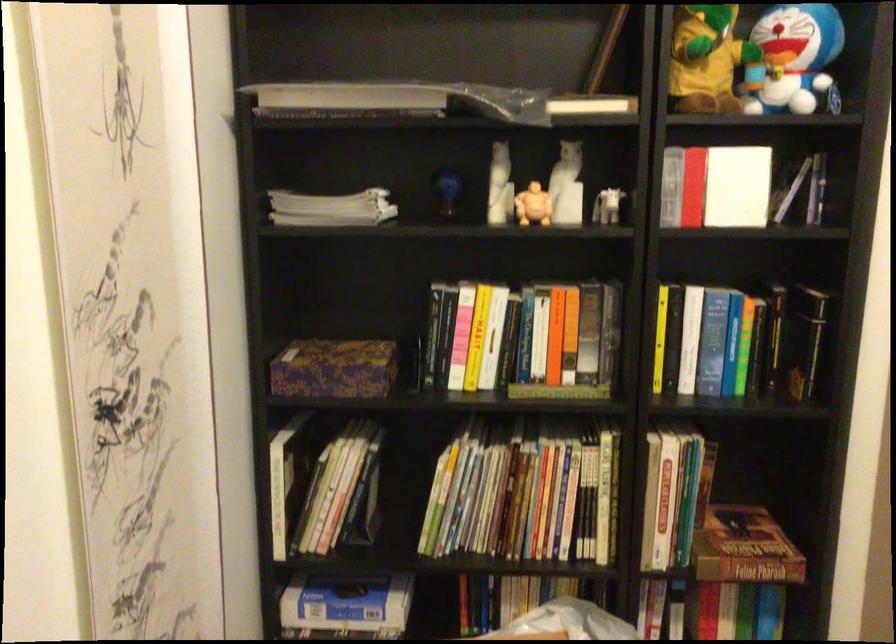
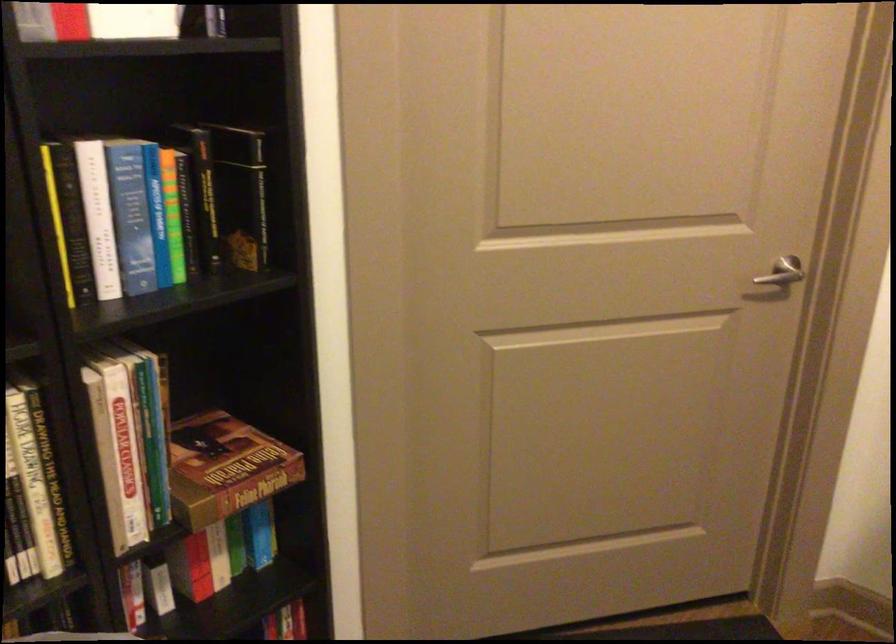
Where in the second image is the point corresponding to pixel 743 544 from the first image?

(225, 468)